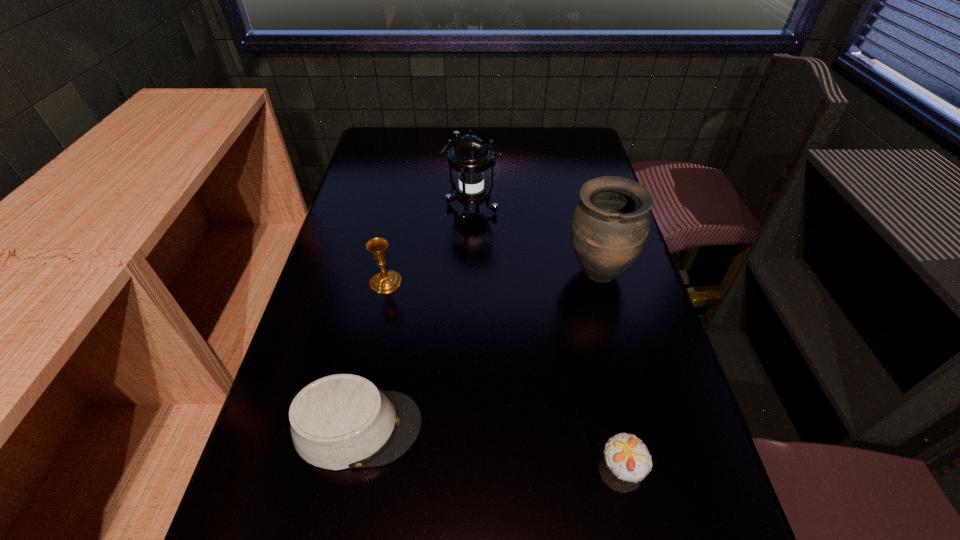
Where is `empty space that is in between the urn and the cupcake`? empty space that is in between the urn and the cupcake is located at coordinates (609, 372).

Find the location of a particular element. This screenshot has height=540, width=960. free spot between the urn and the chalice is located at coordinates (492, 278).

Where is `free spot between the lantern and the urn`? This screenshot has width=960, height=540. free spot between the lantern and the urn is located at coordinates (535, 241).

Where is `vacant space that is in between the hat and the urn`? vacant space that is in between the hat and the urn is located at coordinates (478, 350).

Image resolution: width=960 pixels, height=540 pixels. I want to click on unoccupied area between the lantern and the chalice, so click(x=428, y=246).

Where is `free space between the hat and the third tallest object`? free space between the hat and the third tallest object is located at coordinates (372, 355).

Find the location of a particular element. Image resolution: width=960 pixels, height=540 pixels. empty space between the chalice and the urn is located at coordinates (492, 278).

At what (x,y) coordinates should I click in order to perform the action: click on the third closest object to the cupcake. Please return your answer as a coordinate pair (x, y). The image size is (960, 540). Looking at the image, I should click on (384, 282).

Choose which object is the nearest neighbor to the cupcake. Please provide its 2D coordinates. Your answer should be formatted as a tuple, i.e. [(x, y)], where the tuple contains the x and y coordinates of a point satisfying the conditions above.

[(342, 421)]

This screenshot has width=960, height=540. Find the location of `vacant region that satisfies the following two spatial constraints: 1. on the front-facing side of the hat; 2. on the left side of the cupcake`. vacant region that satisfies the following two spatial constraints: 1. on the front-facing side of the hat; 2. on the left side of the cupcake is located at coordinates (349, 470).